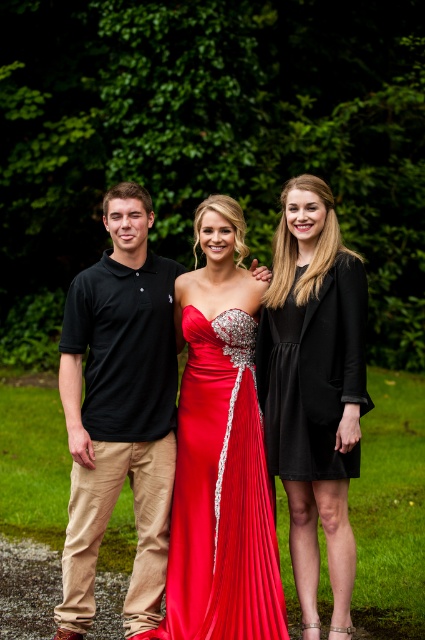
Question: Is black cotton polo shirt at left above black satin dress at right?

Choices:
 (A) no
 (B) yes

Answer: (A)

Question: Which is nearer to the black satin dress at right?

Choices:
 (A) black matte dress at right
 (B) black cotton polo shirt at left

Answer: (A)

Question: Which of the following is the farthest from the observer?

Choices:
 (A) black satin dress at right
 (B) black matte dress at right
 (C) black cotton polo shirt at left

Answer: (C)

Question: Considering the real-world distances, which object is closest to the black matte dress at right?

Choices:
 (A) black satin dress at right
 (B) shiny satin gown at center

Answer: (A)

Question: Does black cotton polo shirt at left appear on the right side of black satin dress at right?

Choices:
 (A) no
 (B) yes

Answer: (A)

Question: Is black matte dress at right below black satin dress at right?

Choices:
 (A) yes
 (B) no

Answer: (A)